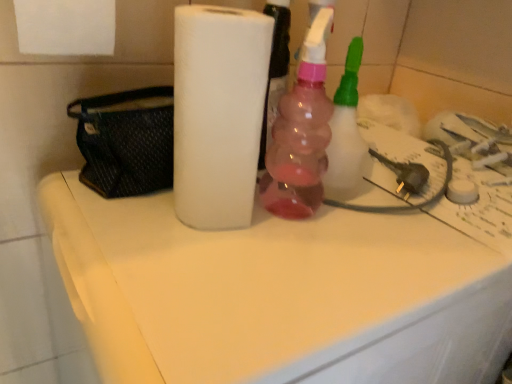
Question: Can you confirm if pink translucent bottle at center is wider than white matte counter top at center?

Choices:
 (A) yes
 (B) no

Answer: (B)

Question: Is pink translucent bottle at center thinner than white matte counter top at center?

Choices:
 (A) no
 (B) yes

Answer: (B)

Question: Considering the relative sizes of pink translucent bottle at center and white matte counter top at center in the image provided, is pink translucent bottle at center shorter than white matte counter top at center?

Choices:
 (A) yes
 (B) no

Answer: (A)

Question: Does pink translucent bottle at center have a larger size compared to white matte counter top at center?

Choices:
 (A) no
 (B) yes

Answer: (A)

Question: Can you confirm if pink translucent bottle at center is positioned to the left of white matte counter top at center?

Choices:
 (A) no
 (B) yes

Answer: (A)

Question: From a real-world perspective, relative to white matte counter top at center, is black mesh pouch at left vertically above or below?

Choices:
 (A) above
 (B) below

Answer: (A)

Question: From their relative heights in the image, would you say black mesh pouch at left is taller or shorter than white matte counter top at center?

Choices:
 (A) short
 (B) tall

Answer: (A)

Question: Based on their sizes in the image, would you say black mesh pouch at left is bigger or smaller than white matte counter top at center?

Choices:
 (A) big
 (B) small

Answer: (B)

Question: Which is correct: black mesh pouch at left is inside white matte counter top at center, or outside of it?

Choices:
 (A) outside
 (B) inside

Answer: (B)

Question: Looking at the image, does white matte paper towel at center seem bigger or smaller compared to black mesh pouch at left?

Choices:
 (A) small
 (B) big

Answer: (B)

Question: Visually, is white matte paper towel at center positioned to the left or to the right of black mesh pouch at left?

Choices:
 (A) right
 (B) left

Answer: (A)

Question: Considering their positions, is white matte paper towel at center located in front of or behind black mesh pouch at left?

Choices:
 (A) front
 (B) behind

Answer: (A)

Question: From a real-world perspective, is white matte paper towel at center positioned above or below black mesh pouch at left?

Choices:
 (A) above
 (B) below

Answer: (A)

Question: From a real-world perspective, is black mesh pouch at left positioned above or below pink translucent bottle at center?

Choices:
 (A) above
 (B) below

Answer: (B)

Question: Based on their positions, is black mesh pouch at left located to the left or right of pink translucent bottle at center?

Choices:
 (A) left
 (B) right

Answer: (A)